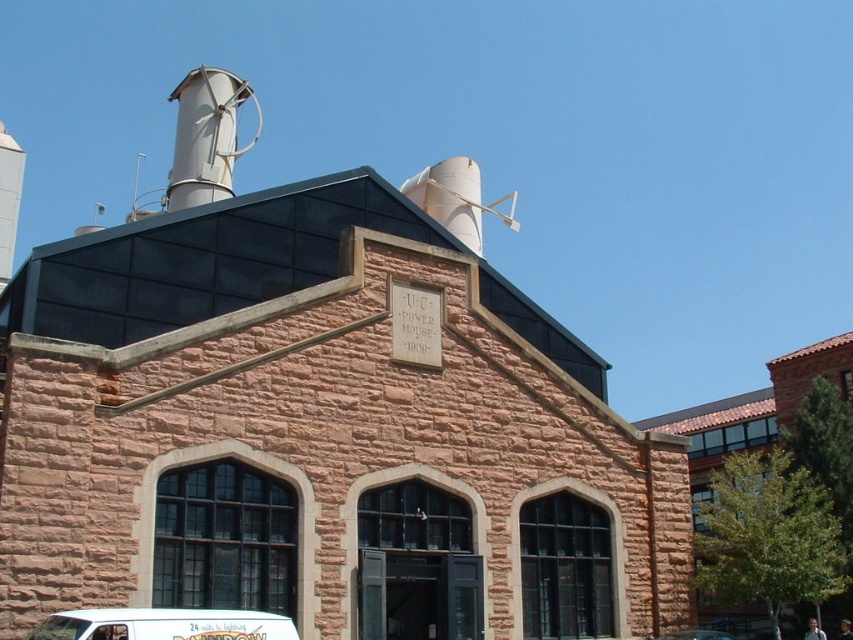
Question: Is white matte van at lower center in front of white matte van at center?

Choices:
 (A) yes
 (B) no

Answer: (A)

Question: Which point is closer to the camera?

Choices:
 (A) (726, 637)
 (B) (173, 99)

Answer: (A)

Question: Which is nearer to the white matte van at center?

Choices:
 (A) metallic silver chimney at upper left
 (B) white matte van at lower center

Answer: (B)

Question: Which point is farther to the camera?

Choices:
 (A) metallic silver chimney at upper left
 (B) white matte van at lower center
 (C) white matte van at center

Answer: (A)

Question: Is metallic silver chimney at upper left above white matte van at lower center?

Choices:
 (A) no
 (B) yes

Answer: (B)

Question: Is metallic silver chimney at upper left smaller than white matte van at lower center?

Choices:
 (A) yes
 (B) no

Answer: (B)